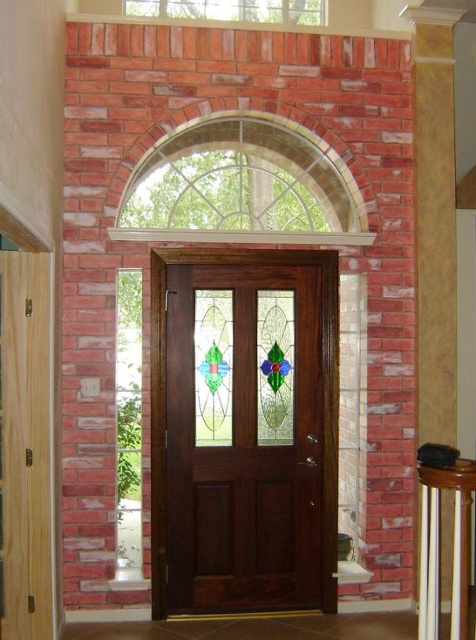
Question: Does clear glass window at center have a smaller size compared to mahogany wood door at center?

Choices:
 (A) yes
 (B) no

Answer: (A)

Question: Estimate the real-world distances between objects in this image. Which object is closer to the clear glass window at upper center?

Choices:
 (A) clear stained glass at left
 (B) white wood balustrade at lower right
 (C) mahogany wood door at center
 (D) clear glass window at center

Answer: (D)

Question: Is clear glass window at center smaller than clear glass window at upper center?

Choices:
 (A) yes
 (B) no

Answer: (B)

Question: Which point is closer to the camera?

Choices:
 (A) (218, 20)
 (B) (335, 173)
 (C) (424, 568)

Answer: (C)

Question: Which object appears closest to the camera in this image?

Choices:
 (A) white wood balustrade at lower right
 (B) clear glass window at center

Answer: (A)

Question: Is clear stained glass at left further to the viewer compared to clear glass window at upper center?

Choices:
 (A) yes
 (B) no

Answer: (B)